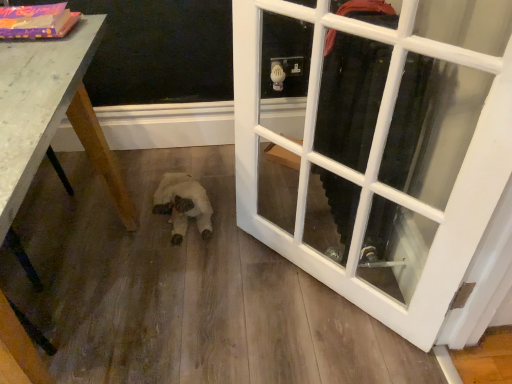
Find the location of a particular element. free location to the left of white glass door at center is located at coordinates (221, 291).